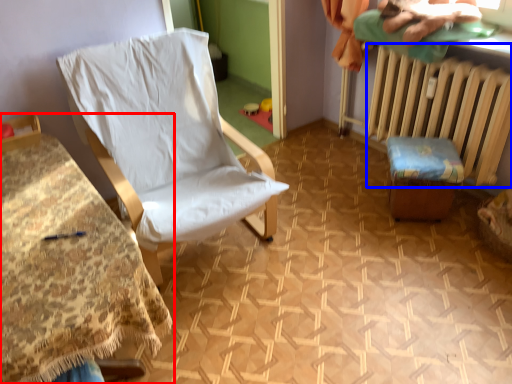
Question: Among these objects, which one is farthest to the camera, furniture (highlighted by a red box) or radiator (highlighted by a blue box)?

Choices:
 (A) furniture
 (B) radiator

Answer: (B)